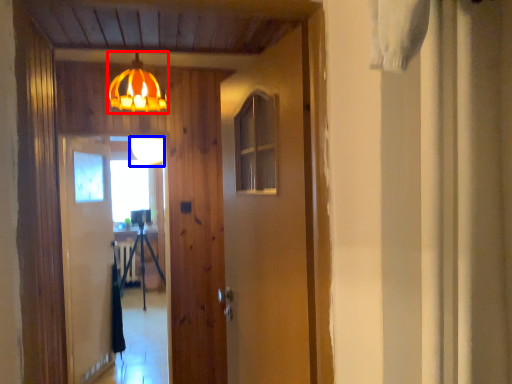
Question: Among these objects, which one is nearest to the camera, lamp (highlighted by a red box) or lamp (highlighted by a blue box)?

Choices:
 (A) lamp
 (B) lamp

Answer: (A)